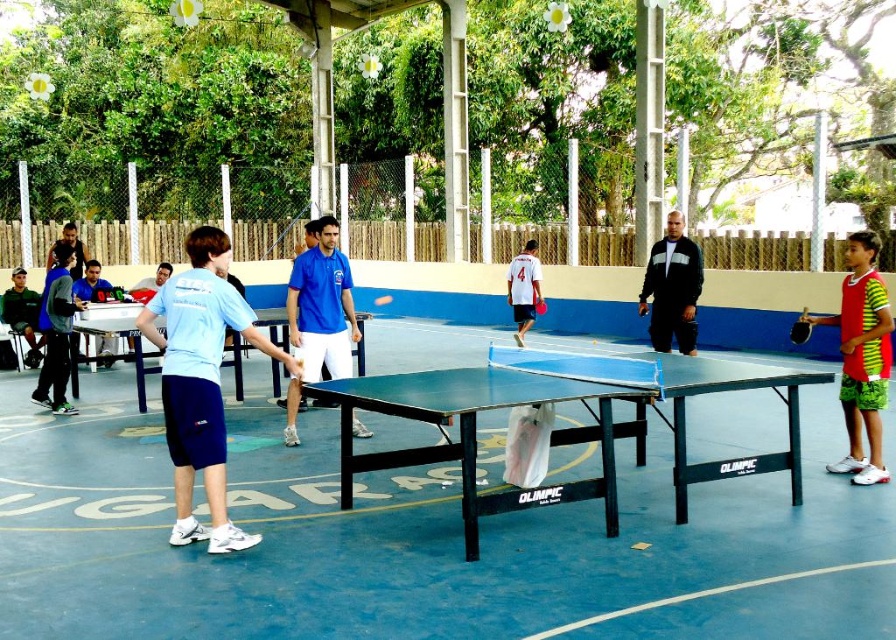
Question: Can you confirm if orange matte ping pong paddle at center is thinner than blue plastic table tennis table at center?

Choices:
 (A) yes
 (B) no

Answer: (A)

Question: Which of the following is the closest to the observer?

Choices:
 (A) black smooth jacket at center
 (B) blue smooth shirt at center
 (C) dark blue shorts at center

Answer: (B)

Question: Observing the image, what is the correct spatial positioning of green fabric jacket at left in reference to dark blue shorts at center?

Choices:
 (A) below
 (B) above

Answer: (A)

Question: Does green fabric jacket at left lie behind blue plastic table tennis table at center?

Choices:
 (A) no
 (B) yes

Answer: (A)

Question: Which of these objects is positioned closest to the blue glossy table tennis table at center?

Choices:
 (A) blue plastic table tennis table at center
 (B) white matte shirt at center

Answer: (B)

Question: Which of the following is the closest to the observer?

Choices:
 (A) orange matte ping pong paddle at center
 (B) light blue fabric shirt at center

Answer: (B)